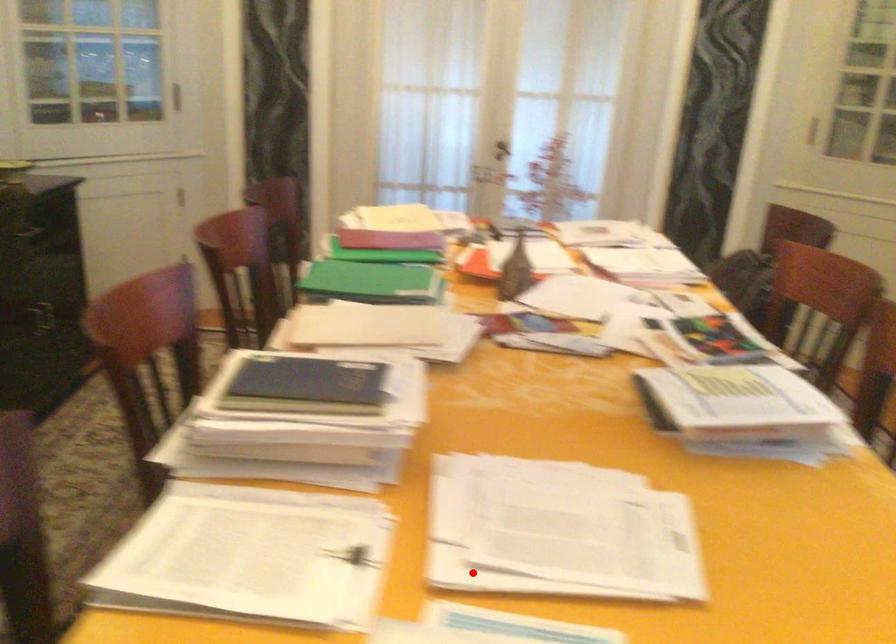
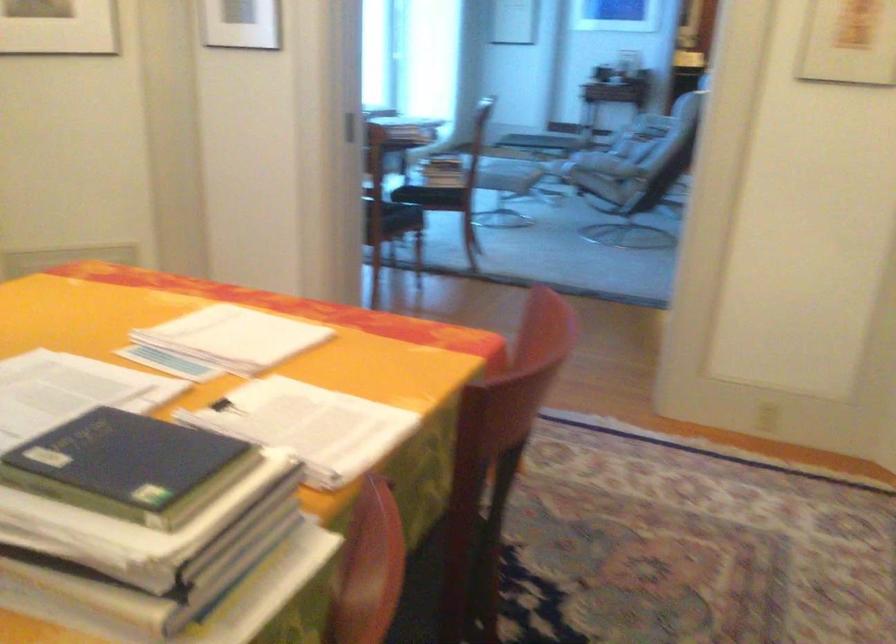
The point at the highlighted location is marked in the first image. Where is the corresponding point in the second image?

(226, 408)